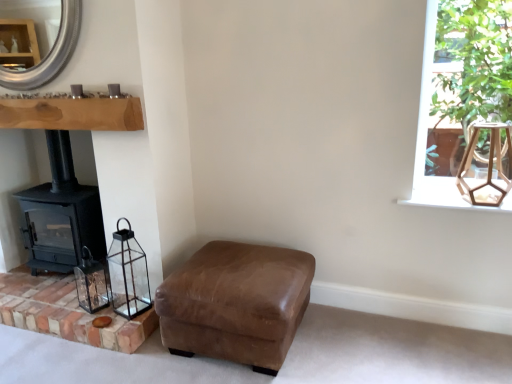
The image size is (512, 384). I want to click on vacant space in front of clear glass lantern at lower left, so (x=91, y=316).